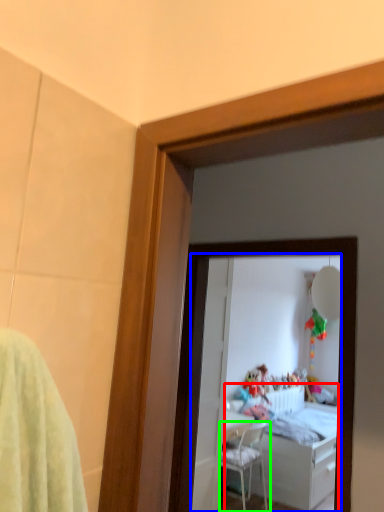
Question: Which object is positioned closest to bed (highlighted by a red box)? Select from mirror (highlighted by a blue box) and chair (highlighted by a green box).

Choices:
 (A) mirror
 (B) chair

Answer: (A)